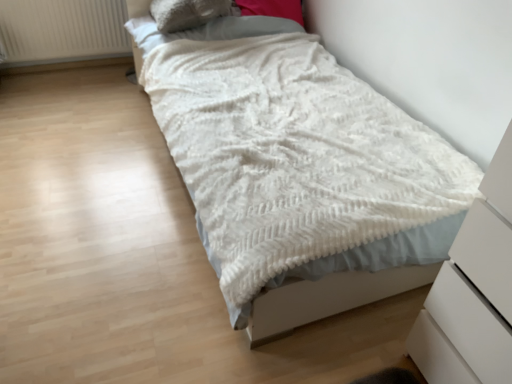
Question: Should I look upward or downward to see white textured blanket at center?

Choices:
 (A) up
 (B) down

Answer: (A)

Question: Does white textured radiator at upper left lie in front of white textured blanket at center?

Choices:
 (A) yes
 (B) no

Answer: (B)

Question: From the image's perspective, is white textured radiator at upper left on top of white textured blanket at center?

Choices:
 (A) yes
 (B) no

Answer: (A)

Question: Considering the relative sizes of white textured radiator at upper left and white textured blanket at center in the image provided, is white textured radiator at upper left taller than white textured blanket at center?

Choices:
 (A) no
 (B) yes

Answer: (A)

Question: Can you confirm if white textured radiator at upper left is thinner than white textured blanket at center?

Choices:
 (A) yes
 (B) no

Answer: (A)

Question: From a real-world perspective, is white textured radiator at upper left on top of white textured blanket at center?

Choices:
 (A) no
 (B) yes

Answer: (A)

Question: Are white textured radiator at upper left and white textured blanket at center making contact?

Choices:
 (A) no
 (B) yes

Answer: (A)

Question: Is white textured blanket at center taller than white textured radiator at upper left?

Choices:
 (A) no
 (B) yes

Answer: (B)

Question: Considering the relative sizes of white textured blanket at center and white textured radiator at upper left in the image provided, is white textured blanket at center thinner than white textured radiator at upper left?

Choices:
 (A) yes
 (B) no

Answer: (B)

Question: Is white textured blanket at center positioned far away from white textured radiator at upper left?

Choices:
 (A) no
 (B) yes

Answer: (B)

Question: Considering the relative sizes of white textured blanket at center and white textured radiator at upper left in the image provided, is white textured blanket at center smaller than white textured radiator at upper left?

Choices:
 (A) no
 (B) yes

Answer: (A)

Question: Is white textured blanket at center placed right next to white textured radiator at upper left?

Choices:
 (A) no
 (B) yes

Answer: (A)

Question: Does white textured blanket at center lie behind white textured radiator at upper left?

Choices:
 (A) yes
 (B) no

Answer: (B)

Question: Considering the relative sizes of fuzzy beige pillow at upper center and white matte chest of drawers at lower right in the image provided, is fuzzy beige pillow at upper center shorter than white matte chest of drawers at lower right?

Choices:
 (A) no
 (B) yes

Answer: (B)